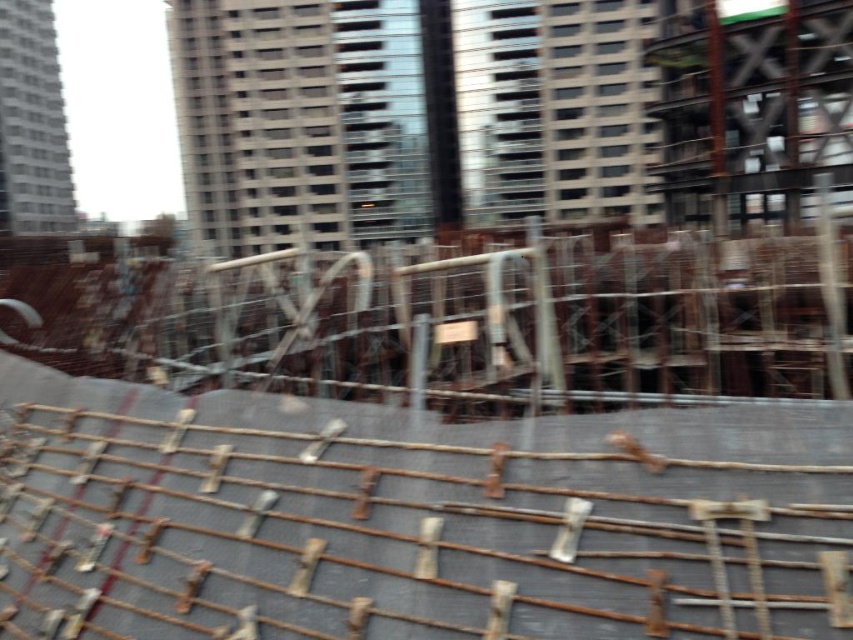
Question: Which point is closer to the camera?

Choices:
 (A) rusty metal rebar at center
 (B) rusty metal fence at center

Answer: (A)

Question: Does rusty metal rebar at center appear on the right side of rusty metal fence at center?

Choices:
 (A) yes
 (B) no

Answer: (A)

Question: Is rusty metal rebar at center closer to the viewer compared to rusty metal fence at center?

Choices:
 (A) yes
 (B) no

Answer: (A)

Question: Which point is farther to the camera?

Choices:
 (A) rusty metal fence at center
 (B) rusty metal rebar at center

Answer: (A)

Question: Can you confirm if rusty metal rebar at center is wider than rusty metal fence at center?

Choices:
 (A) no
 (B) yes

Answer: (A)